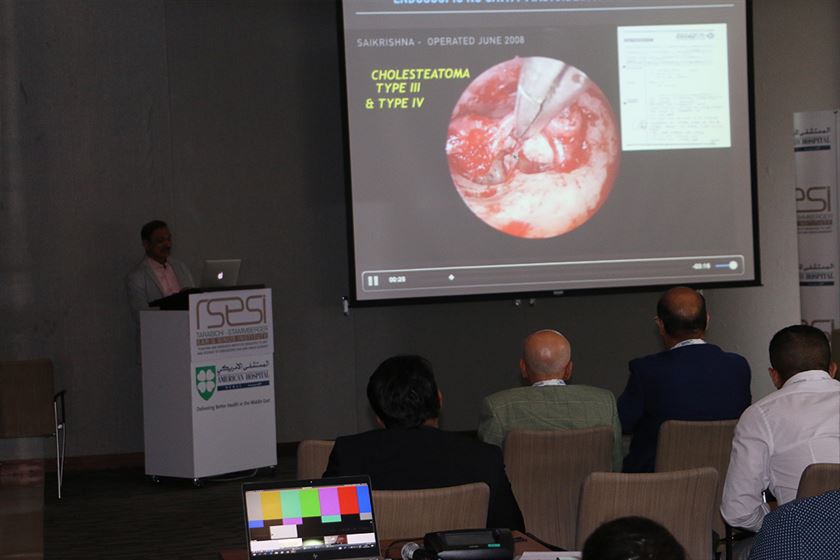
This screenshot has height=560, width=840. I want to click on box, so (234, 407).